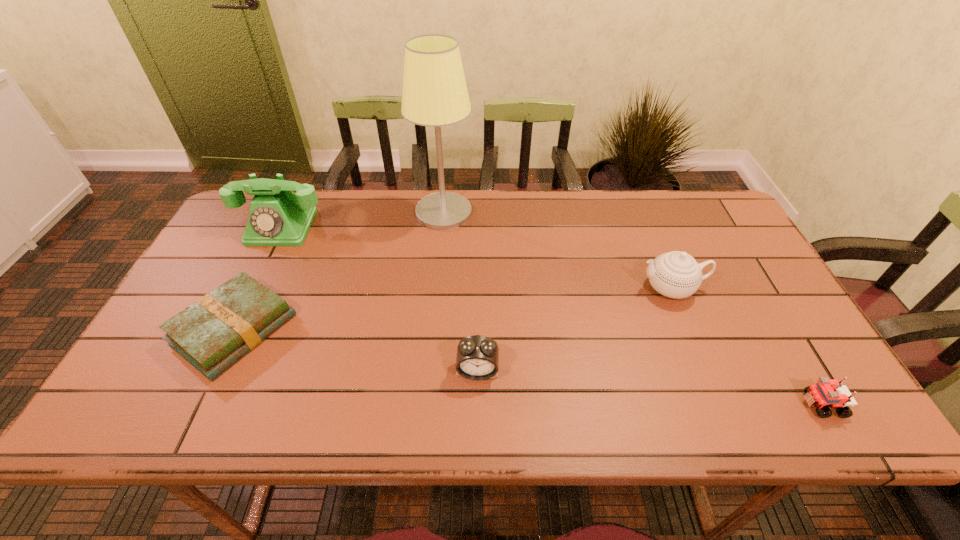
At what (x,y) coordinates should I click in order to perform the action: click on telephone at the left edge. Please return your answer as a coordinate pair (x, y). The image size is (960, 540). Looking at the image, I should click on (277, 217).

Locate an element on the screen. This screenshot has height=540, width=960. book at the left edge is located at coordinates (213, 333).

You are a GUI agent. You are given a task and a screenshot of the screen. Output one action in this format:
    pyautogui.click(x=<x>, y=<y>)
    Task: Click on the object that is at the right edge
    The image size is (960, 540).
    Given the screenshot: What is the action you would take?
    pyautogui.click(x=826, y=393)

The image size is (960, 540). Identify the location of object present at the far left corner. (277, 217).

This screenshot has width=960, height=540. What are the coordinates of `object present at the near right corner` in the screenshot? It's located at (826, 393).

At what (x,y) coordinates should I click in order to perform the action: click on vacant space at the far edge. Please return your answer as a coordinate pair (x, y). This screenshot has width=960, height=540. Looking at the image, I should click on (494, 211).

Where is `vacant area at the near edge`? The image size is (960, 540). vacant area at the near edge is located at coordinates (536, 426).

Identify the location of vacant space at the right edge of the desktop. This screenshot has height=540, width=960. (765, 299).

Locate an element on the screen. This screenshot has height=540, width=960. vacant space at the far right corner of the desktop is located at coordinates (712, 202).

This screenshot has height=540, width=960. I want to click on vacant position at the near right corner of the desktop, so click(786, 426).